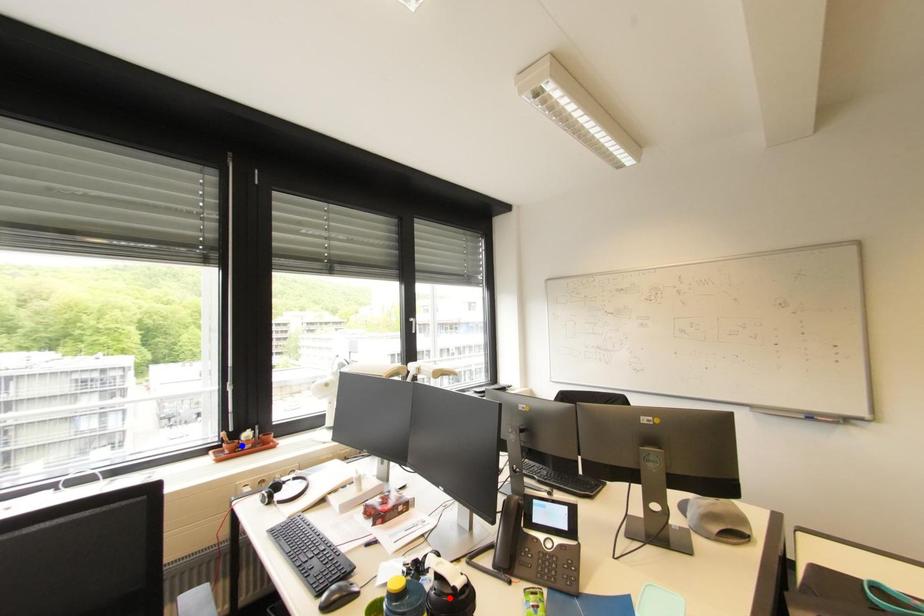
Question: Which of the two points in the image is closer to the camera?

Choices:
 (A) Blue point is closer.
 (B) Red point is closer.

Answer: (B)